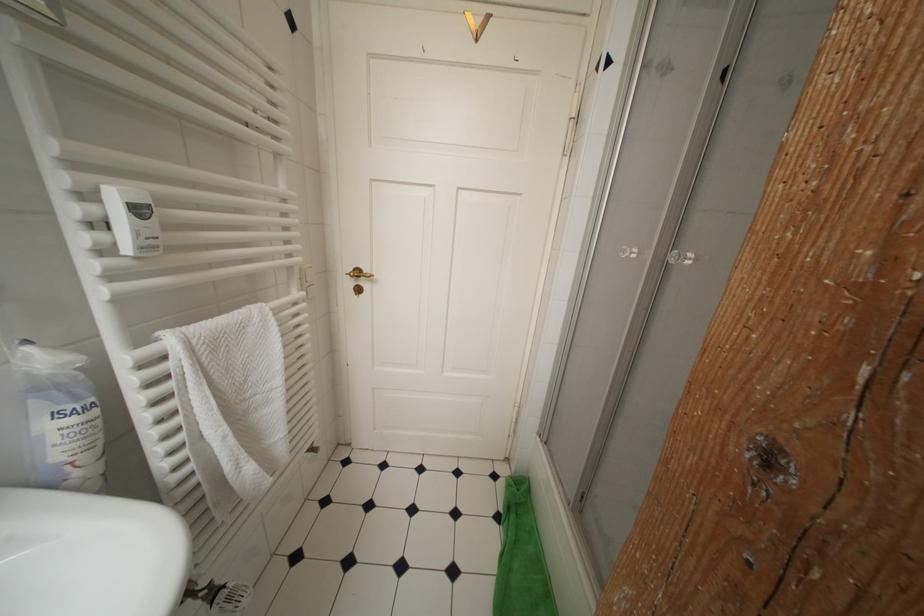
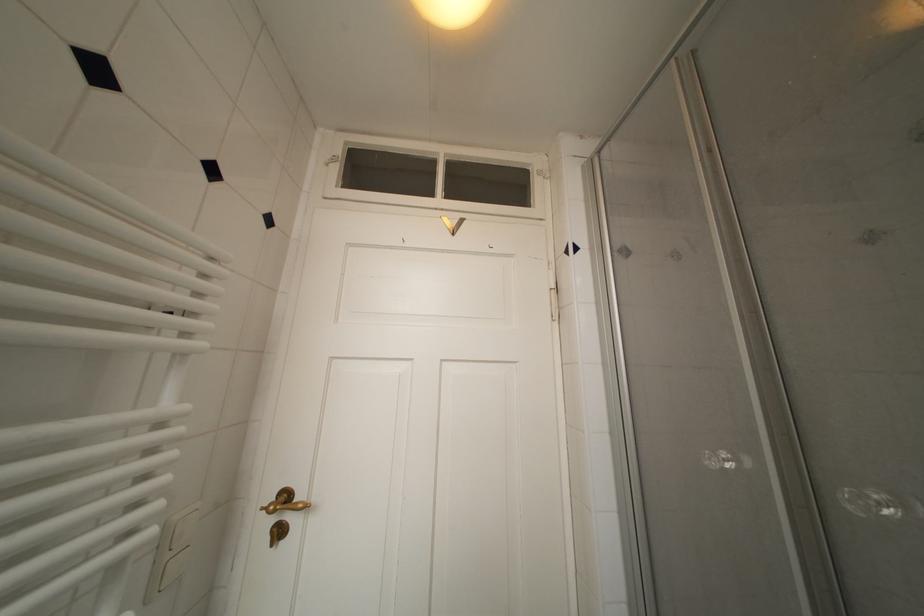
Find the pixel in the second image that matches pixel 313 288 in the first image.

(176, 559)